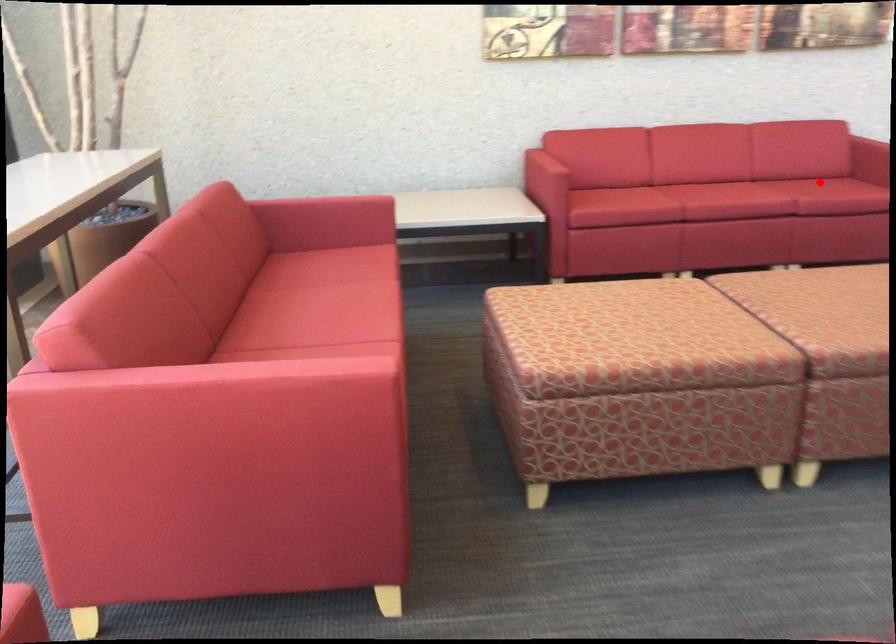
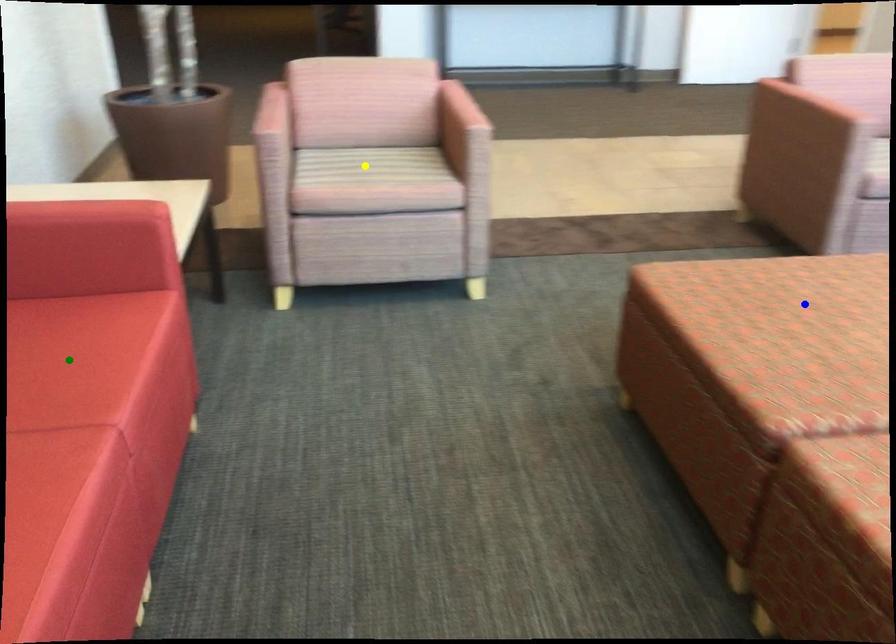
Question: I am providing you with two images of the same scene from different viewpoints. A red point is marked on the first image. You are given multiple points on the second image. Which mark in image 2 goes with the point in image 1?

Choices:
 (A) green point
 (B) yellow point
 (C) blue point

Answer: (A)